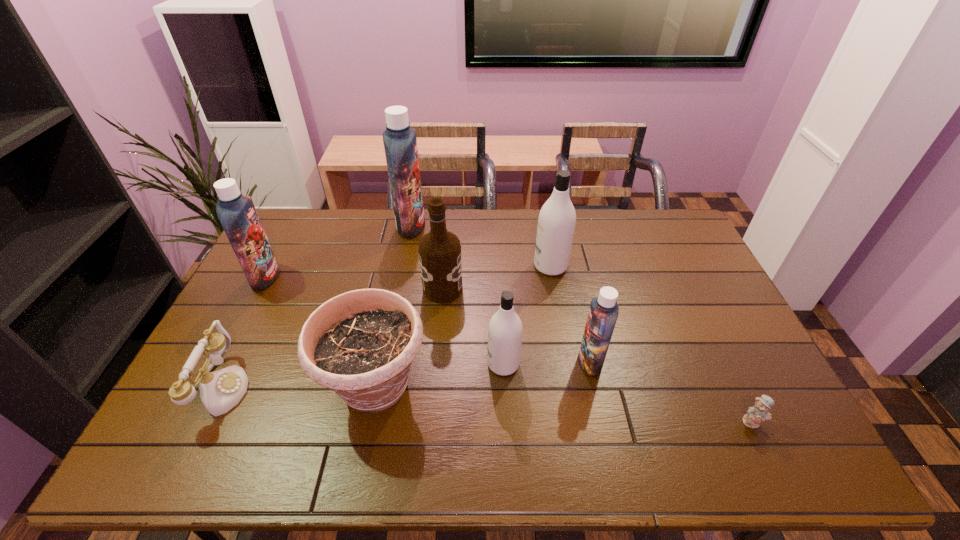
This screenshot has width=960, height=540. I want to click on free region located 0.050m on the front-facing side of the blue teddy bear, so click(x=766, y=450).

At what (x,y) coordinates should I click in order to perform the action: click on object at the far edge. Please return your answer as a coordinate pair (x, y). Looking at the image, I should click on (400, 142).

Image resolution: width=960 pixels, height=540 pixels. I want to click on object situated at the near edge, so click(361, 344).

The height and width of the screenshot is (540, 960). In order to click on shampoo at the left edge in this screenshot , I will do `click(237, 214)`.

You are a GUI agent. You are given a task and a screenshot of the screen. Output one action in this format:
    pyautogui.click(x=<x>, y=<y>)
    Task: Click on the telephone located at the left edge
    Image resolution: width=960 pixels, height=540 pixels.
    Given the screenshot: What is the action you would take?
    pyautogui.click(x=220, y=391)

What are the coordinates of `object at the right edge` in the screenshot? It's located at (759, 411).

Identify the location of vacant space at the far edge of the desktop. (464, 226).

Image resolution: width=960 pixels, height=540 pixels. I want to click on free space at the near edge of the desktop, so click(228, 470).

You are a GUI agent. You are given a task and a screenshot of the screen. Output one action in this format:
    pyautogui.click(x=<x>, y=<y>)
    Task: Click on the vacant position at the left edge of the desktop
    
    Given the screenshot: What is the action you would take?
    pyautogui.click(x=233, y=314)

In the image, there is a desktop. At what (x,y) coordinates should I click in order to perform the action: click on free region at the right edge. Please return your answer as a coordinate pair (x, y). This screenshot has height=540, width=960. Looking at the image, I should click on (x=722, y=301).